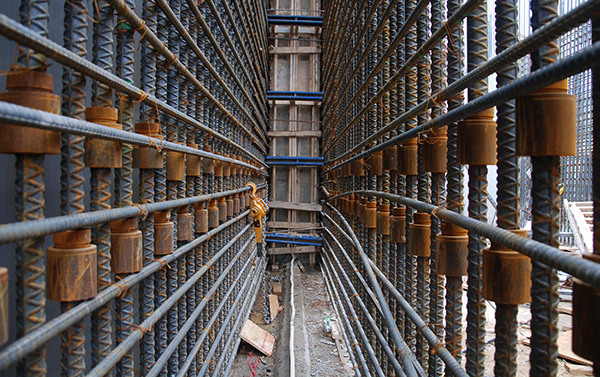
Find the location of `concrete floor`. concrete floor is located at coordinates (322, 352).